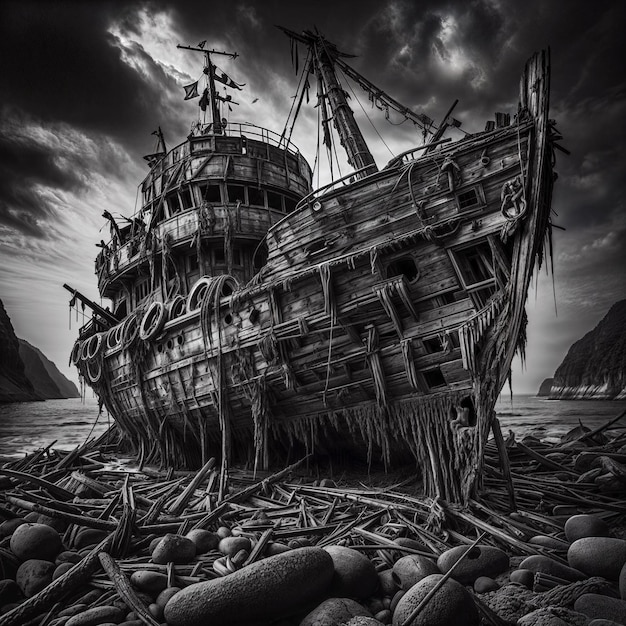
What are the coordinates of `window` in the screenshot? It's located at (409, 268).